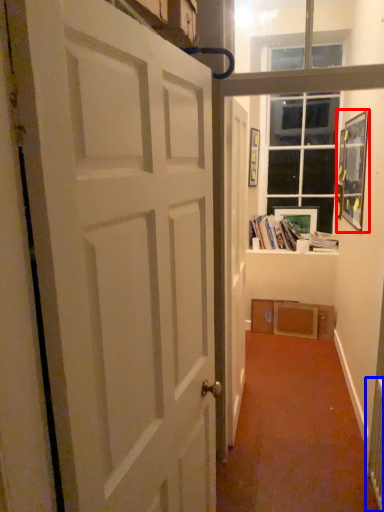
Question: Which point is closer to the camera, picture frame (highlighted by a red box) or radiator (highlighted by a blue box)?

Choices:
 (A) picture frame
 (B) radiator

Answer: (B)